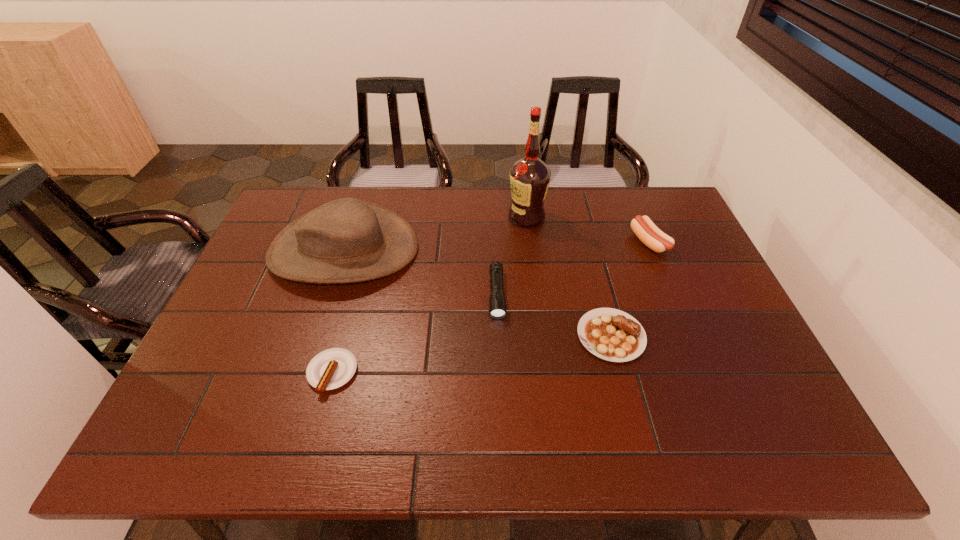
Image resolution: width=960 pixels, height=540 pixels. Find the location of `the third object from right to left`. the third object from right to left is located at coordinates (530, 177).

This screenshot has width=960, height=540. What are the coordinates of `alcohol` in the screenshot? It's located at (530, 177).

You are a GUI agent. You are given a task and a screenshot of the screen. Output one action in this format:
    pyautogui.click(x=<x>, y=<y>)
    Task: Click on the cowboy hat
    This screenshot has height=540, width=960.
    Given the screenshot: What is the action you would take?
    347,240

You are a GUI agent. You are given a task and a screenshot of the screen. Output one action in this format:
    pyautogui.click(x=<x>, y=<y>)
    Task: Click on the rightmost object
    The width and height of the screenshot is (960, 540).
    Given the screenshot: What is the action you would take?
    pyautogui.click(x=648, y=233)

In order to click on the taller sausage in this screenshot , I will do `click(648, 233)`.

Locate an element on the screen. the third shortest object is located at coordinates (497, 302).

Locate an element on the screen. Image resolution: width=960 pixels, height=540 pixels. flashlight is located at coordinates (497, 302).

The width and height of the screenshot is (960, 540). Identify the location of steak. (610, 334).

The height and width of the screenshot is (540, 960). Identify the location of the left sausage. click(x=332, y=368).

At what (x,y) coordinates should I click in order to perform the action: click on the nearer sausage. Please return your answer as a coordinate pair (x, y). The height and width of the screenshot is (540, 960). Looking at the image, I should click on (332, 368).